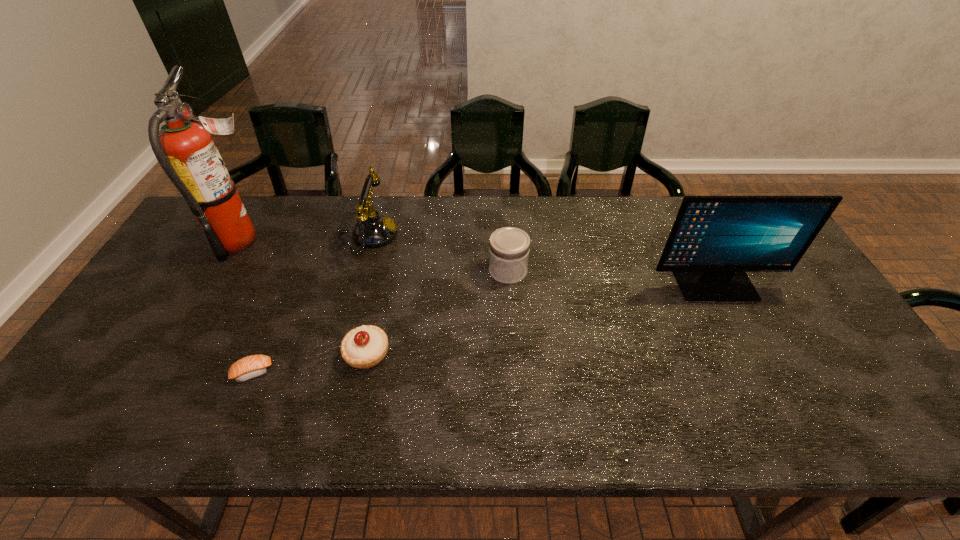
Locate an element on the screen. vacant region located 0.120m from the nozzle of the tallest object is located at coordinates (308, 240).

What are the coordinates of `blank space located 0.280m on the screen side of the second tallest object` in the screenshot? It's located at (769, 393).

You are a GUI agent. You are given a task and a screenshot of the screen. Output one action in this format:
    pyautogui.click(x=<x>, y=<y>)
    Task: Click on the vacant space located 0.250m on the dial of the third tallest object
    
    Given the screenshot: What is the action you would take?
    (476, 236)

The image size is (960, 540). I want to click on vacant space located 0.370m on the front of the third shortest object, so click(x=516, y=403).

Locate an element on the screen. vacant space located on the right of the pastry is located at coordinates (455, 354).

Where is `vacant space located 0.270m on the left of the sushi`? The image size is (960, 540). vacant space located 0.270m on the left of the sushi is located at coordinates (120, 372).

You are a GUI agent. You are given a task and a screenshot of the screen. Output one action in this format:
    pyautogui.click(x=<x>, y=<y>)
    Task: Click on the fire extinguisher positioned at the far edge
    
    Given the screenshot: What is the action you would take?
    pyautogui.click(x=184, y=148)

Where is `telephone that is at the far edge`? Image resolution: width=960 pixels, height=540 pixels. telephone that is at the far edge is located at coordinates (372, 230).

Locate an element on the screen. This screenshot has width=960, height=540. object that is positioned at the left edge is located at coordinates (184, 148).

In order to click on object that is positioned at the right edge in this screenshot , I will do `click(715, 240)`.